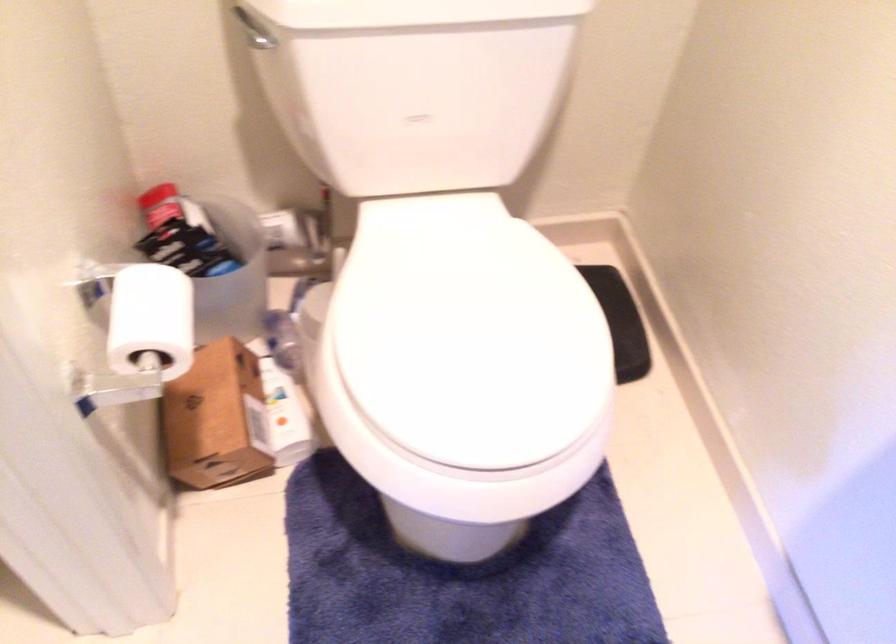
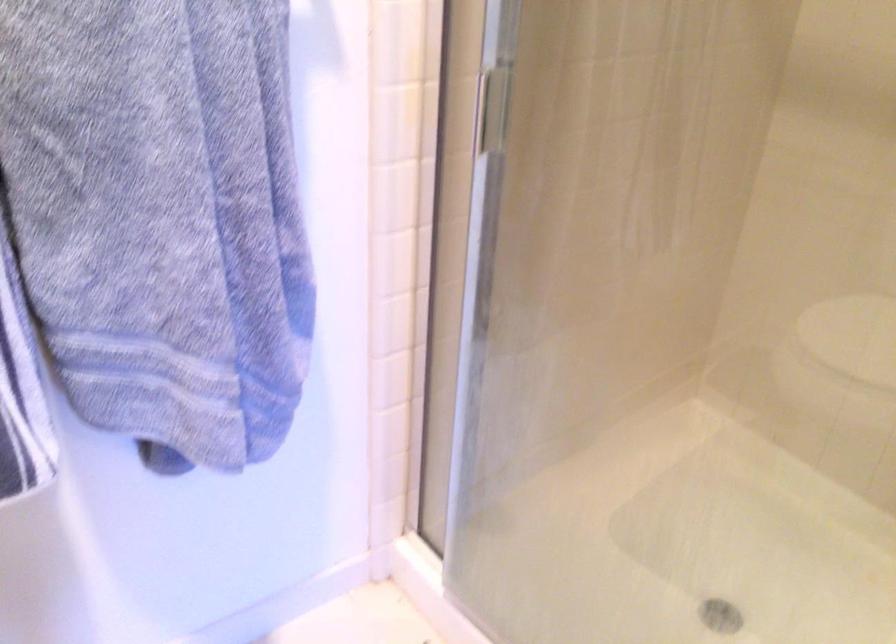
How did the camera likely rotate?

The camera rotated toward right-down.